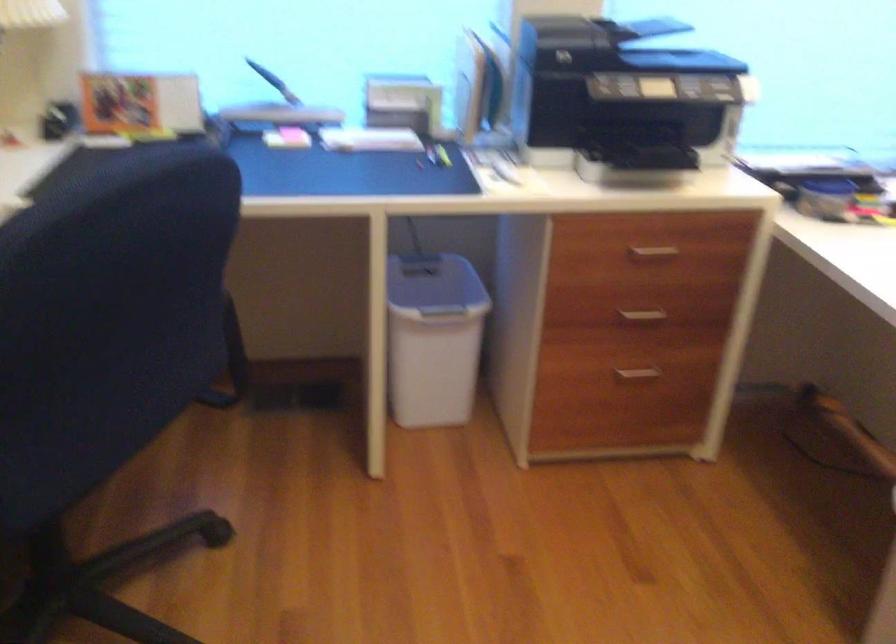
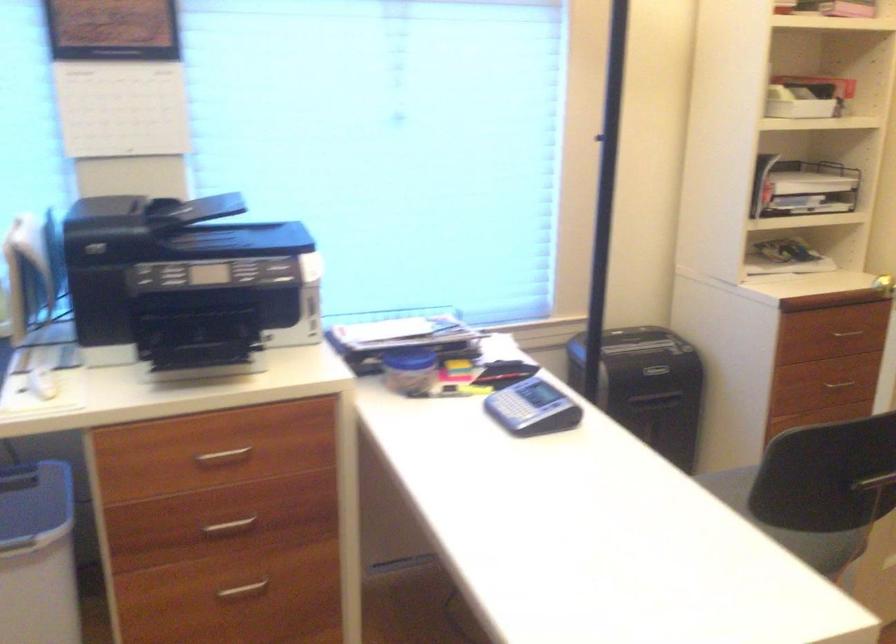
Where in the second image is the point corresponding to (x=639, y=316) from the first image?

(228, 527)